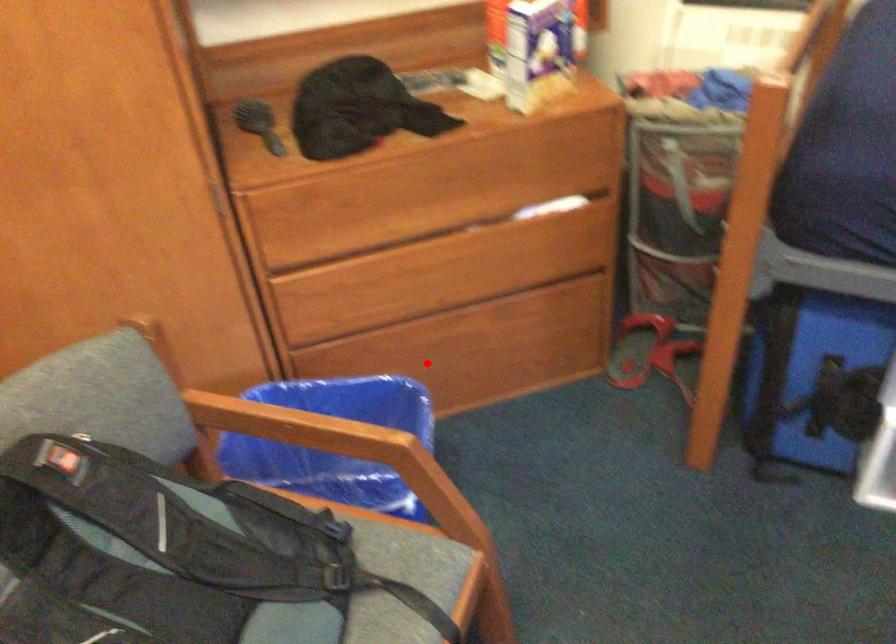
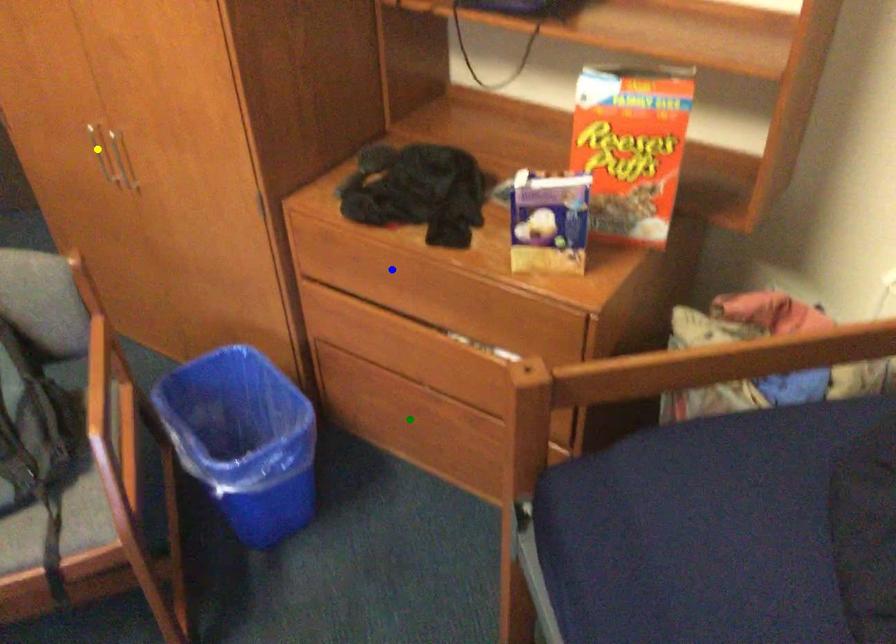
Question: I am providing you with two images of the same scene from different viewpoints. A red point is marked on the first image. You are given multiple points on the second image. Which mark in image 2 goes with the point in image 1?

Choices:
 (A) green point
 (B) blue point
 (C) yellow point

Answer: (A)